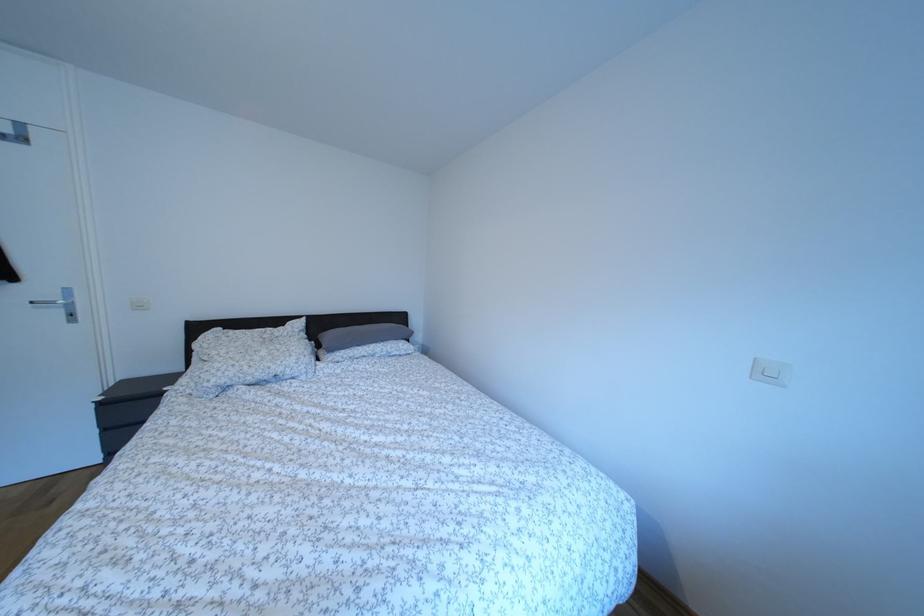
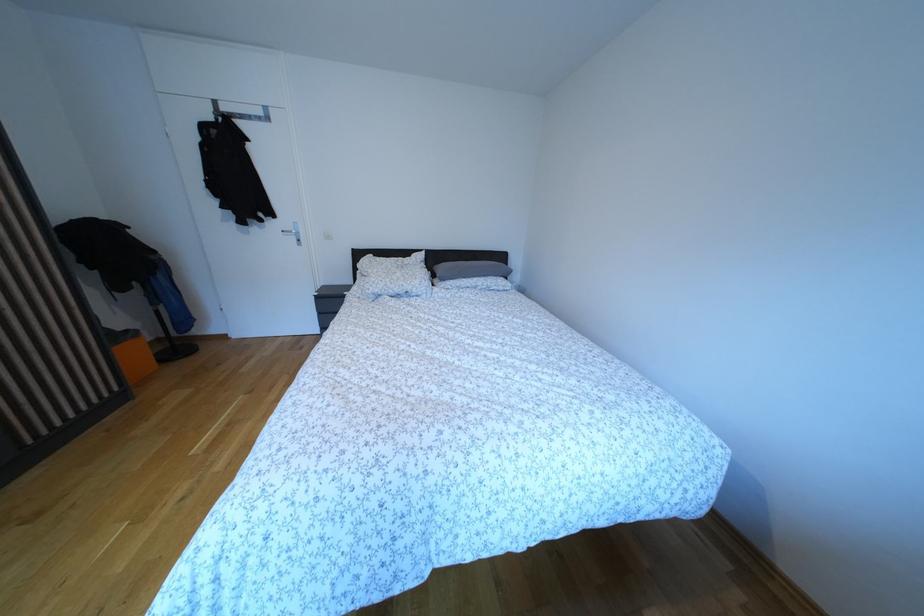
Find the pixel in the second image that matches (x=270, y=360) in the first image.

(406, 281)